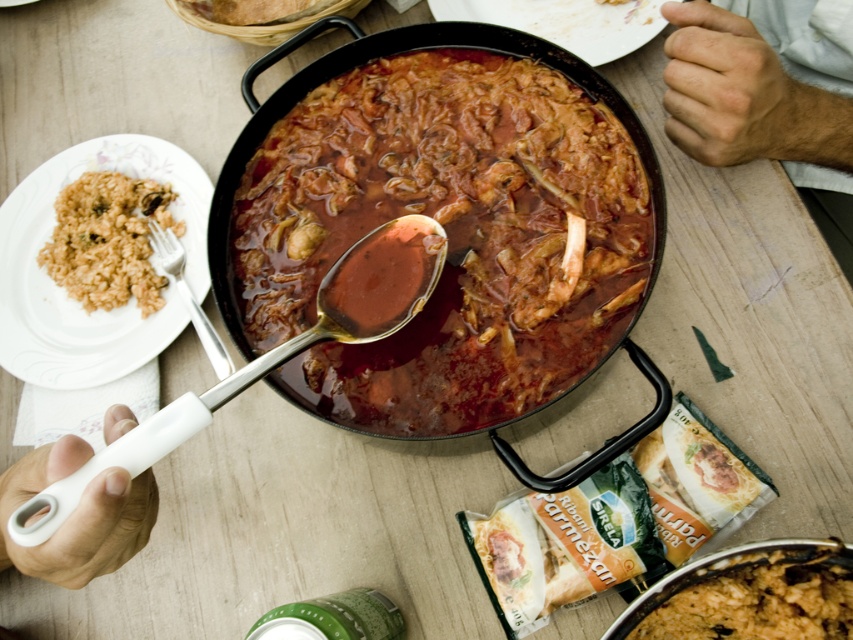
Question: Can you confirm if brown glossy stew at center is positioned above white plastic spoon at center?

Choices:
 (A) yes
 (B) no

Answer: (A)

Question: Which point appears closest to the camera in this image?

Choices:
 (A) (463, 317)
 (B) (120, 234)
 (C) (427, 227)
 (D) (670, 604)

Answer: (D)

Question: From the image, what is the correct spatial relationship of brown matte rice at lower right in relation to brown rice at upper left?

Choices:
 (A) above
 (B) below

Answer: (B)

Question: Is brown matte rice at upper left to the left of white plastic spoon at center from the viewer's perspective?

Choices:
 (A) no
 (B) yes

Answer: (B)

Question: Estimate the real-world distances between objects in this image. Which object is farther from the brown matte rice at upper left?

Choices:
 (A) white plastic spoon at center
 (B) brown glossy stew at center
 (C) brown matte rice at lower right

Answer: (C)

Question: Which point is closer to the camera?

Choices:
 (A) white plastic spoon at lower left
 (B) brown rice at upper left

Answer: (A)